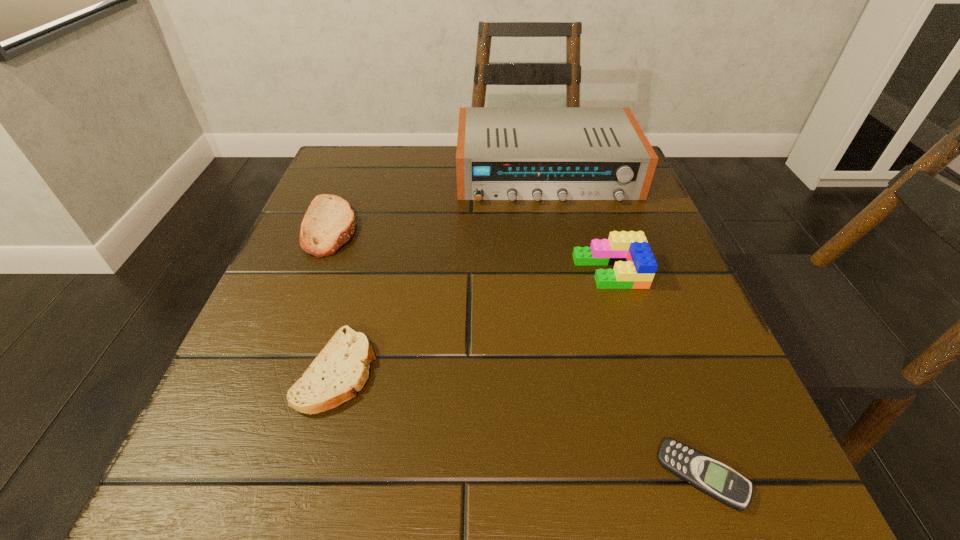
Locate an element on the screen. vacant space positioned on the front of the farther pita bread is located at coordinates (268, 387).

The height and width of the screenshot is (540, 960). Find the location of `free spot located 0.270m on the back of the shorter pita bread`. free spot located 0.270m on the back of the shorter pita bread is located at coordinates coord(378,222).

You are a GUI agent. You are given a task and a screenshot of the screen. Output one action in this format:
    pyautogui.click(x=<x>, y=<y>)
    Task: Click on the vacant space located on the back of the shortest object
    The width and height of the screenshot is (960, 540).
    Given the screenshot: What is the action you would take?
    pyautogui.click(x=661, y=361)

Where is `radio receiver at the far edge`? Image resolution: width=960 pixels, height=540 pixels. radio receiver at the far edge is located at coordinates point(503,153).

At what (x,y) coordinates should I click in order to perform the action: click on pita bread present at the far edge. Please return your answer as a coordinate pair (x, y). Looking at the image, I should click on (329, 222).

Where is `object positioned at the near edge`? object positioned at the near edge is located at coordinates (708, 475).

I want to click on radio receiver that is at the right edge, so click(503, 153).

Image resolution: width=960 pixels, height=540 pixels. What are the coordinates of `Lego that is at the right edge` in the screenshot? It's located at (634, 264).

Where is `beeper that is at the right edge`? beeper that is at the right edge is located at coordinates (708, 475).

The image size is (960, 540). Find the location of `object situated at the far left corner`. object situated at the far left corner is located at coordinates (329, 222).